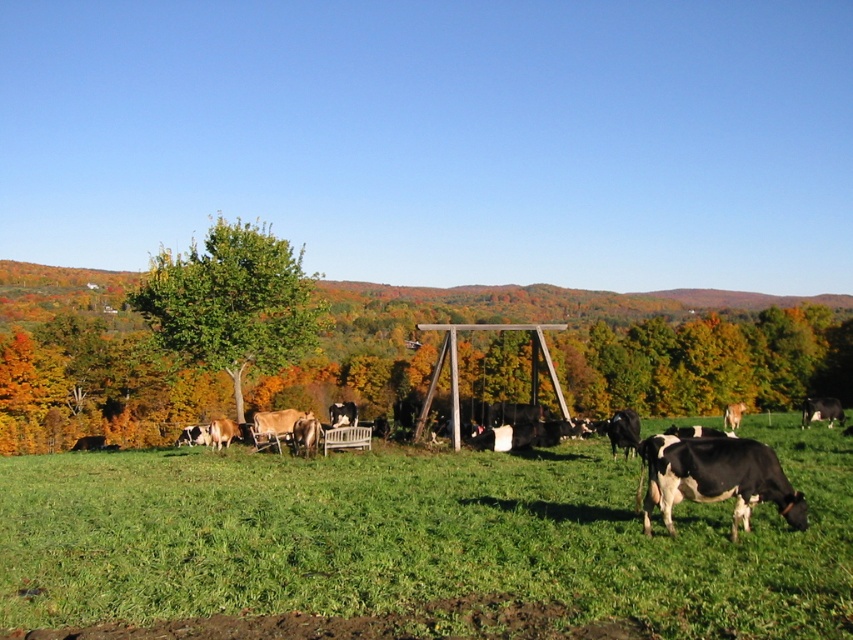
I want to click on black and white cow at right, so click(821, 410).

Looking at this image, can you confirm if black and white cow at right is positioned above black and white cow at center?

Indeed, black and white cow at right is positioned over black and white cow at center.

Between point (811, 406) and point (339, 422), which one is positioned in front?

Positioned in front is point (339, 422).

Locate an element on the screen. black and white cow at right is located at coordinates (821, 410).

Can you confirm if green grassy field at center is smaller than black and white cow at center?

Yes, green grassy field at center is smaller than black and white cow at center.

Is green grassy field at center to the left of black and white cow at center from the viewer's perspective?

No, green grassy field at center is not to the left of black and white cow at center.

Where is `green grassy field at center`? The image size is (853, 640). green grassy field at center is located at coordinates (x=418, y=540).

Looking at this image, between black glossy cow at lower right and black and white cow at right, which one is positioned lower?

black and white cow at right is lower down.

Does point (738, 445) come closer to viewer compared to point (828, 426)?

Yes, it is in front of point (828, 426).

Identify the location of black glossy cow at lower right. The image size is (853, 640). (717, 477).